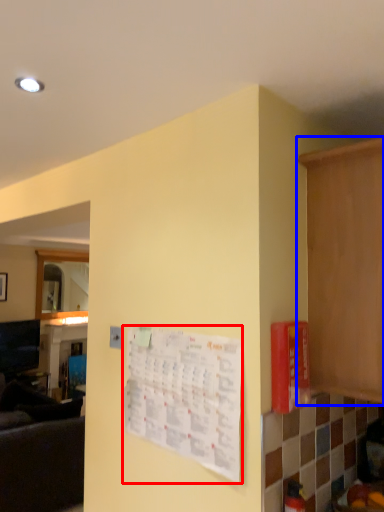
Question: Which object appears farthest to the camera in this image, bulletin board (highlighted by a red box) or cabinetry (highlighted by a blue box)?

Choices:
 (A) bulletin board
 (B) cabinetry

Answer: (A)